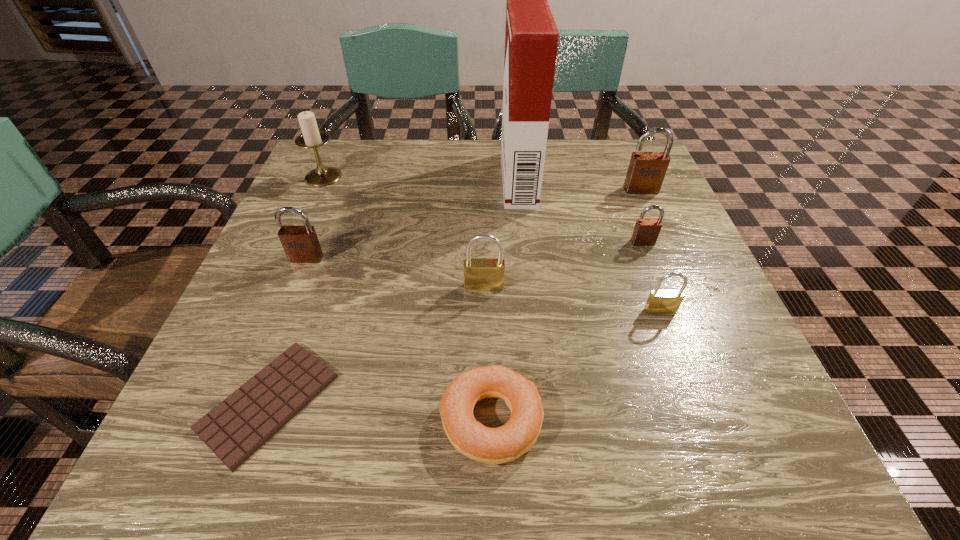
Locate an element on the screen. free region at the near edge of the desktop is located at coordinates click(x=324, y=444).

You are a GUI agent. You are given a task and a screenshot of the screen. Output one action in this format:
    pyautogui.click(x=<x>, y=<y>)
    Task: Click on the free space at the left edge of the desktop
    The height and width of the screenshot is (540, 960).
    Given the screenshot: What is the action you would take?
    pyautogui.click(x=252, y=301)

This screenshot has width=960, height=540. Find the location of `blank space at the right edge`. blank space at the right edge is located at coordinates (756, 386).

The height and width of the screenshot is (540, 960). In the image, there is a desktop. Find the location of `blank space at the far left corner`. blank space at the far left corner is located at coordinates 322,147.

Locate an element on the screen. The width and height of the screenshot is (960, 540). vacant space at the near left corner of the desktop is located at coordinates (261, 453).

Locate an element on the screen. This screenshot has height=540, width=960. free space at the far right corner of the desktop is located at coordinates (606, 153).

The image size is (960, 540). Find the location of `free area in between the fourth nearest padlock and the white candle holder`. free area in between the fourth nearest padlock and the white candle holder is located at coordinates (483, 210).

The height and width of the screenshot is (540, 960). Identify the location of free space between the fourth padlock from right to left and the third nearest object. (572, 299).

In order to click on vacant area between the right brass padlock and the farthest padlock in this screenshot , I will do `click(651, 250)`.

Identify the location of free space between the smaller brass padlock and the fourth farthest padlock. Image resolution: width=960 pixels, height=540 pixels. (572, 299).